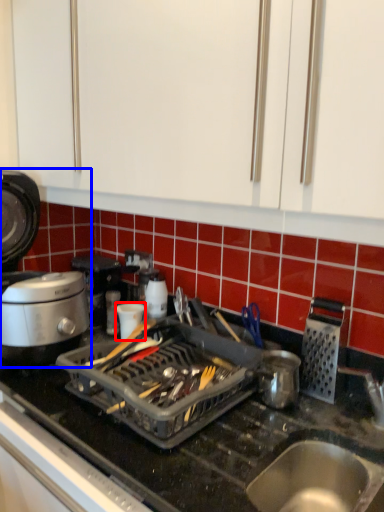
Question: Among these objects, which one is nearest to the camera, kitchen appliance (highlighted by a red box) or kitchen appliance (highlighted by a blue box)?

Choices:
 (A) kitchen appliance
 (B) kitchen appliance

Answer: (B)